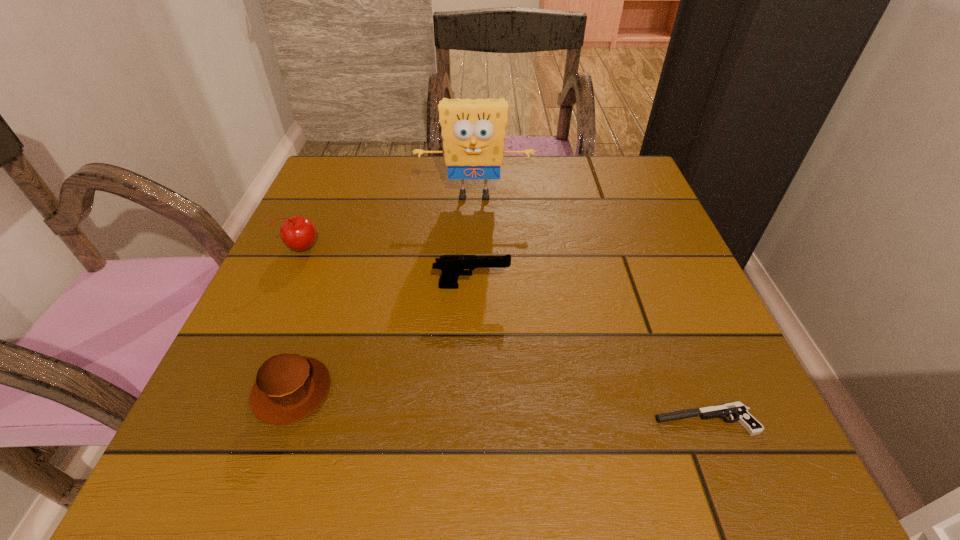
I want to click on vacant region at the near right corner of the desktop, so click(x=710, y=485).

In order to click on free space that is in between the farthest object and the muffin in this screenshot , I will do `click(383, 293)`.

Where is `blank region between the farthest object and the shortest object`? This screenshot has width=960, height=540. blank region between the farthest object and the shortest object is located at coordinates (589, 308).

The width and height of the screenshot is (960, 540). In order to click on vacant area that lies between the muffin and the sponge in this screenshot , I will do `click(383, 293)`.

The width and height of the screenshot is (960, 540). In order to click on free area in between the third farthest object and the rightmost object in this screenshot , I will do `click(588, 353)`.

Where is `empty space between the muffin and the fourth nearest object`? empty space between the muffin and the fourth nearest object is located at coordinates (298, 319).

Find the location of `free space between the rightmost object and the fourth tallest object`. free space between the rightmost object and the fourth tallest object is located at coordinates (498, 406).

Identify the location of vacant space in between the shorter pistol and the third farthest object. (588, 353).

Find the location of a particular element. This screenshot has width=960, height=540. free space between the farther pistol and the fourth tallest object is located at coordinates (382, 339).

Where is `vacant point located between the sponge and the cherry`? The height and width of the screenshot is (540, 960). vacant point located between the sponge and the cherry is located at coordinates (389, 221).